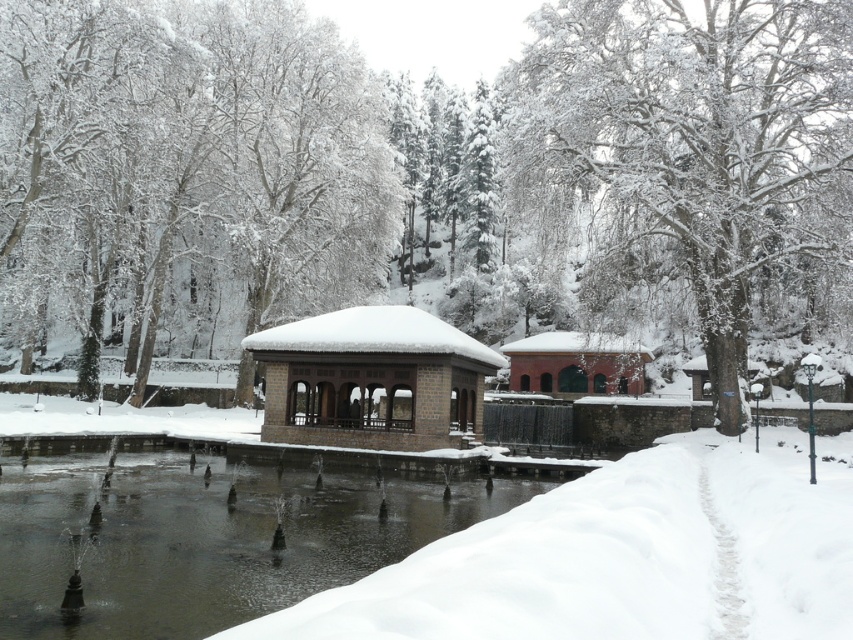
Question: Is clear water at center thinner than brick textured building at center?

Choices:
 (A) no
 (B) yes

Answer: (A)

Question: Considering the real-world distances, which object is farthest from the white brick gazebo at center?

Choices:
 (A) snow-covered tree at center
 (B) clear water at center
 (C) brick textured building at center
 (D) white fluffy snow at lower left

Answer: (C)

Question: Does clear water at center lie behind white brick gazebo at center?

Choices:
 (A) no
 (B) yes

Answer: (A)

Question: Which point is farther from the camera taking this photo?

Choices:
 (A) (163, 580)
 (B) (618, 33)

Answer: (B)

Question: Estimate the real-world distances between objects in this image. Which object is farther from the white fluffy snow at lower left?

Choices:
 (A) snow-covered tree at center
 (B) white brick gazebo at center
 (C) clear water at center
 (D) brick textured building at center

Answer: (D)

Question: Where is snow-covered tree at center located in relation to white fluffy snow at lower left in the image?

Choices:
 (A) below
 (B) above

Answer: (B)